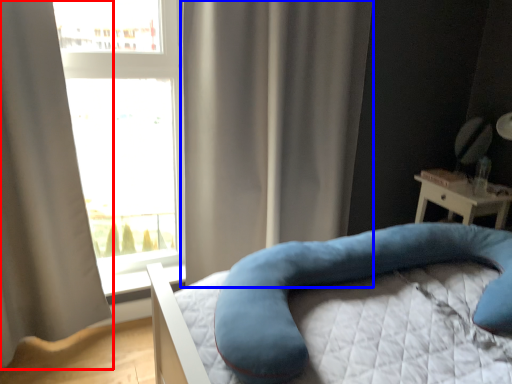
Question: Which object appears farthest to the camera in this image, curtain (highlighted by a red box) or curtain (highlighted by a blue box)?

Choices:
 (A) curtain
 (B) curtain

Answer: (B)